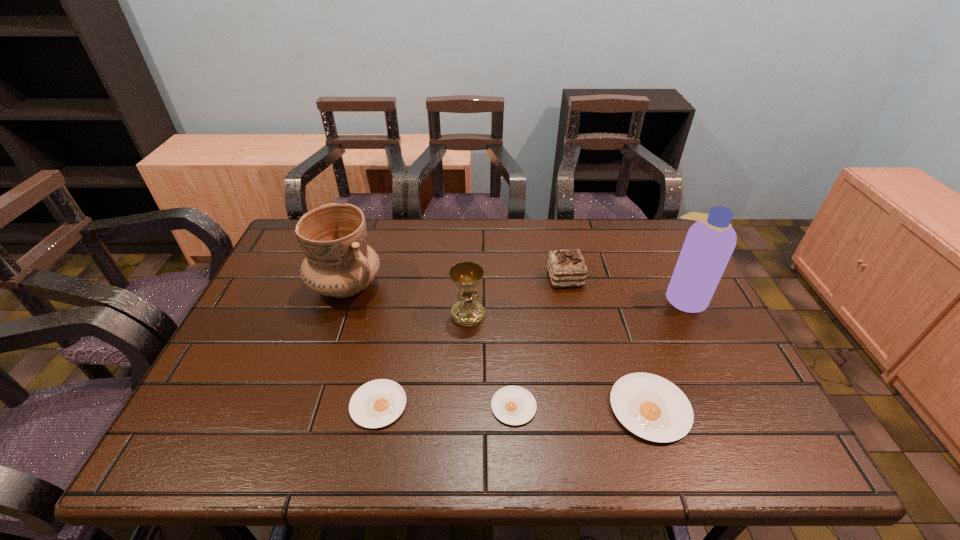
Identify the location of chocolate cake. This screenshot has width=960, height=540. (566, 268).

Find the location of a particular element. Image resolution: width=960 pixels, height=540 pixels. the sixth shortest object is located at coordinates (338, 262).

Find the location of a particular element. vacant space positioned on the right of the second shortest egg yolk is located at coordinates (446, 404).

What are the coordinates of `free space located 0.360m on the right of the shortest egg yolk` in the screenshot? It's located at (698, 406).

Identify the location of vacant space situated on the left of the rightmost egg yolk. This screenshot has height=540, width=960. (470, 408).

Identify the location of free space located on the front of the tallest object. (732, 394).

Image resolution: width=960 pixels, height=540 pixels. I want to click on free space located 0.090m on the left of the fifth object from right to left, so click(x=418, y=314).

Where is `vacant space located on the front of the fourth shortest object`? The width and height of the screenshot is (960, 540). vacant space located on the front of the fourth shortest object is located at coordinates (592, 402).

Find the location of a particular element. free space located 0.210m on the right of the second tallest object is located at coordinates (455, 286).

Find the location of `object that is at the left edge`. object that is at the left edge is located at coordinates (338, 262).